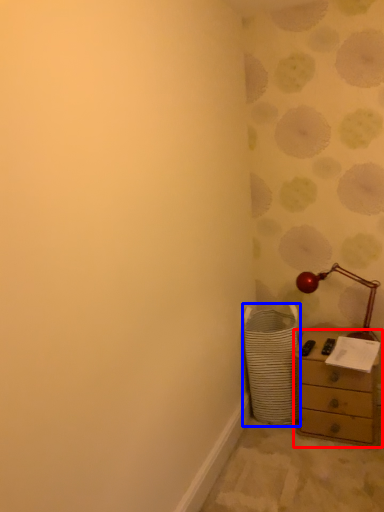
Question: Which of the following is the farthest to the observer, chest of drawers (highlighted by a red box) or laundry basket (highlighted by a blue box)?

Choices:
 (A) chest of drawers
 (B) laundry basket

Answer: (B)